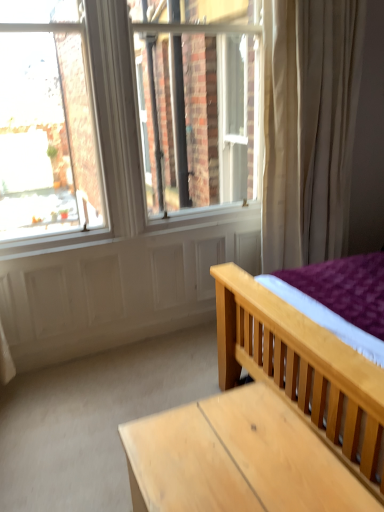
Question: From the image's perspective, does light brown wooden table at lower right appear higher than light wood bed at center?

Choices:
 (A) no
 (B) yes

Answer: (A)

Question: From a real-world perspective, is light brown wooden table at lower right below light wood bed at center?

Choices:
 (A) no
 (B) yes

Answer: (B)

Question: Is light brown wooden table at lower right beside light wood bed at center?

Choices:
 (A) no
 (B) yes

Answer: (A)

Question: Considering the relative sizes of light brown wooden table at lower right and light wood bed at center in the image provided, is light brown wooden table at lower right taller than light wood bed at center?

Choices:
 (A) yes
 (B) no

Answer: (B)

Question: From the image's perspective, is light brown wooden table at lower right below light wood bed at center?

Choices:
 (A) yes
 (B) no

Answer: (A)

Question: Does light brown wooden table at lower right lie in front of light wood bed at center?

Choices:
 (A) no
 (B) yes

Answer: (A)

Question: Does light wood bed at center have a larger size compared to light brown wooden table at lower right?

Choices:
 (A) yes
 (B) no

Answer: (A)

Question: Are light wood bed at center and light brown wooden table at lower right far apart?

Choices:
 (A) no
 (B) yes

Answer: (A)

Question: From the image's perspective, is light wood bed at center above light brown wooden table at lower right?

Choices:
 (A) no
 (B) yes

Answer: (B)

Question: Is light wood bed at center outside light brown wooden table at lower right?

Choices:
 (A) yes
 (B) no

Answer: (A)

Question: Is light wood bed at center taller than light brown wooden table at lower right?

Choices:
 (A) no
 (B) yes

Answer: (B)

Question: Would you say light wood bed at center contains light brown wooden table at lower right?

Choices:
 (A) yes
 (B) no

Answer: (B)

Question: In terms of height, does light brown wooden table at lower right look taller or shorter compared to light wood bed at center?

Choices:
 (A) short
 (B) tall

Answer: (A)